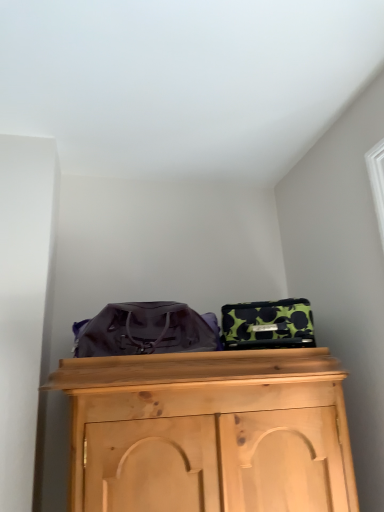
Question: Considering the relative sizes of green polka dot fabric suitcase at upper right and matte purple messenger bag at center in the image provided, is green polka dot fabric suitcase at upper right thinner than matte purple messenger bag at center?

Choices:
 (A) yes
 (B) no

Answer: (A)

Question: Could matte purple messenger bag at center be considered to be inside green polka dot fabric suitcase at upper right?

Choices:
 (A) yes
 (B) no

Answer: (B)

Question: Considering the relative sizes of green polka dot fabric suitcase at upper right and matte purple messenger bag at center in the image provided, is green polka dot fabric suitcase at upper right shorter than matte purple messenger bag at center?

Choices:
 (A) yes
 (B) no

Answer: (A)

Question: Does green polka dot fabric suitcase at upper right have a greater width compared to matte purple messenger bag at center?

Choices:
 (A) no
 (B) yes

Answer: (A)

Question: Can you confirm if green polka dot fabric suitcase at upper right is bigger than matte purple messenger bag at center?

Choices:
 (A) yes
 (B) no

Answer: (B)

Question: Is green polka dot fabric suitcase at upper right oriented towards matte purple messenger bag at center?

Choices:
 (A) no
 (B) yes

Answer: (A)

Question: Is matte purple messenger bag at center positioned before green polka dot fabric suitcase at upper right?

Choices:
 (A) no
 (B) yes

Answer: (B)

Question: Is matte purple messenger bag at center positioned behind green polka dot fabric suitcase at upper right?

Choices:
 (A) no
 (B) yes

Answer: (A)

Question: From the image's perspective, is matte purple messenger bag at center located beneath green polka dot fabric suitcase at upper right?

Choices:
 (A) yes
 (B) no

Answer: (B)

Question: Is matte purple messenger bag at center taller than green polka dot fabric suitcase at upper right?

Choices:
 (A) no
 (B) yes

Answer: (B)

Question: Are matte purple messenger bag at center and green polka dot fabric suitcase at upper right located far from each other?

Choices:
 (A) yes
 (B) no

Answer: (B)

Question: From the image's perspective, is matte purple messenger bag at center on top of green polka dot fabric suitcase at upper right?

Choices:
 (A) no
 (B) yes

Answer: (B)

Question: From a real-world perspective, is matte purple messenger bag at center positioned above or below green polka dot fabric suitcase at upper right?

Choices:
 (A) below
 (B) above

Answer: (B)